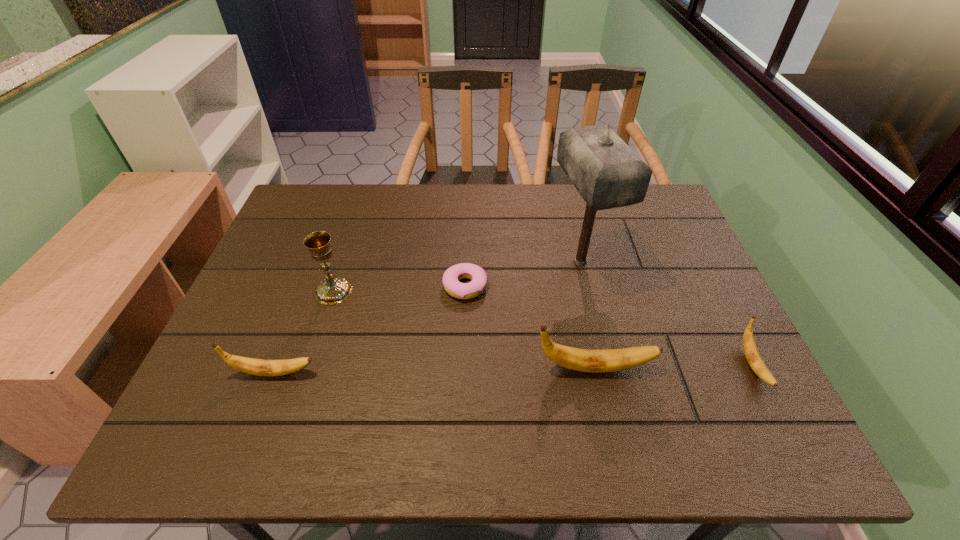
What are the coordinates of `vacant space positioned on the peel of the fourth tallest object from the top` in the screenshot? It's located at point(354,373).

Identify the location of vacant area situated on the peel of the fourth shortest object from the top. Image resolution: width=960 pixels, height=540 pixels. (740, 368).

Where is `free space located 0.260m on the front of the doughnut`? Image resolution: width=960 pixels, height=540 pixels. free space located 0.260m on the front of the doughnut is located at coordinates pos(461,397).

Where is `vacant region located on the left of the mallet`? vacant region located on the left of the mallet is located at coordinates (443, 262).

This screenshot has width=960, height=540. I want to click on blank space located on the left of the fifth shortest object, so (x=257, y=291).

At what (x,y) coordinates should I click in order to perform the action: click on object positioned at the left edge. Please return your answer as a coordinate pair (x, y). This screenshot has width=960, height=540. Looking at the image, I should click on (261, 367).

At what (x,y) coordinates should I click in order to perform the action: click on object situated at the right edge. Please return your answer as a coordinate pair (x, y). The width and height of the screenshot is (960, 540). Looking at the image, I should click on (753, 357).

This screenshot has height=540, width=960. Identify the location of object situated at the near left corner. (261, 367).

Image resolution: width=960 pixels, height=540 pixels. What are the coordinates of `object that is at the near right corner` in the screenshot? It's located at (753, 357).

At what (x,y) coordinates should I click in order to perform the action: click on vacant space at the far edge of the desktop. Please return your answer as a coordinate pair (x, y). Looking at the image, I should click on (387, 194).